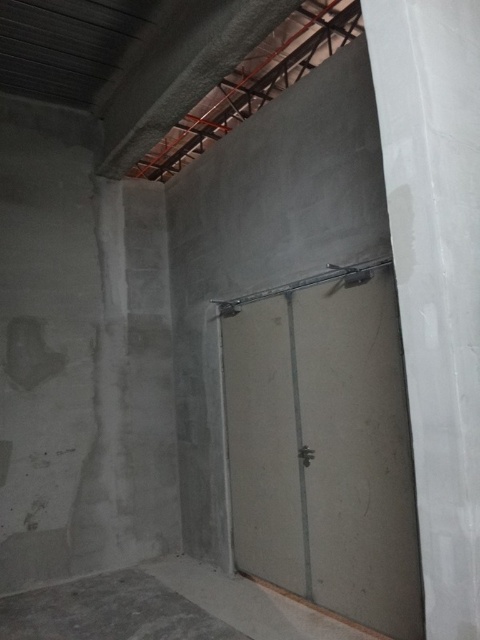
You are an architect inspecting the construction site. You notice the white glossy pillar at right and the gray concrete floor at lower left. Which object has a smaller width?

The white glossy pillar at right has a lesser width compared to the gray concrete floor at lower left.

You are a construction worker carrying a heavy tool box. You need to place it on either the white glossy pillar at right or the gray concrete floor at lower left. Which surface can safely hold the weight of the tool box?

The gray concrete floor at lower left can safely hold the weight of the tool box because the white glossy pillar at right is bigger than gray concrete floor at lower left, implying the pillar may not be designed to bear heavy loads.